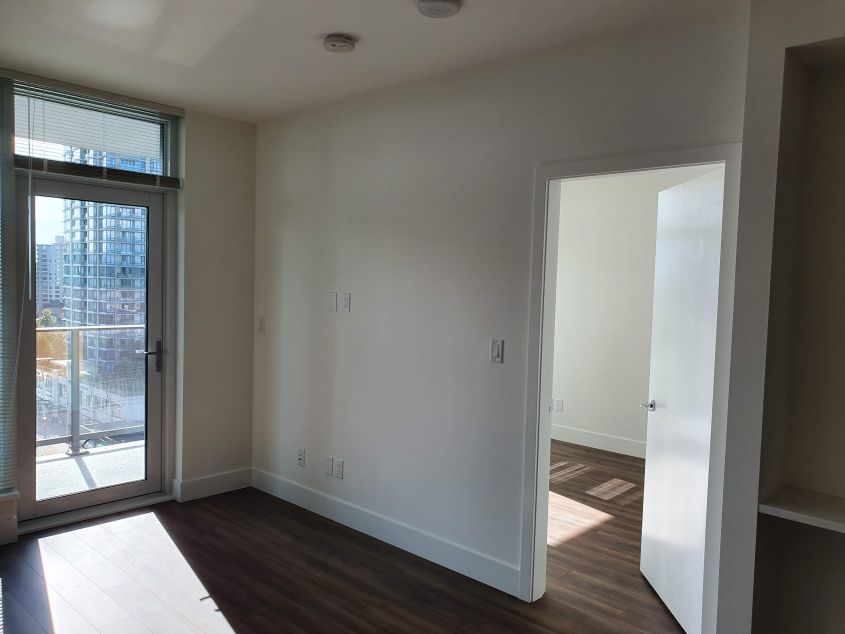
Find the location of a particular element. The height and width of the screenshot is (634, 845). ceiling is located at coordinates (262, 30).